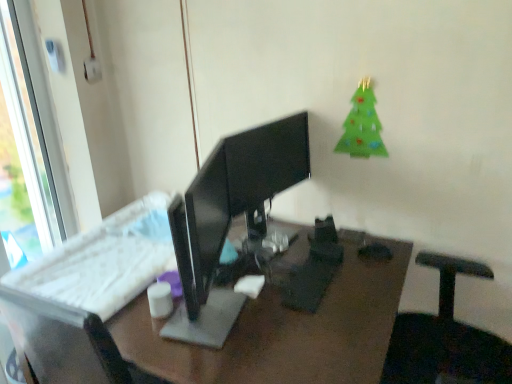
Find the location of `vacant area that is situated to the right of black glossy monitor at center`. vacant area that is situated to the right of black glossy monitor at center is located at coordinates (346, 249).